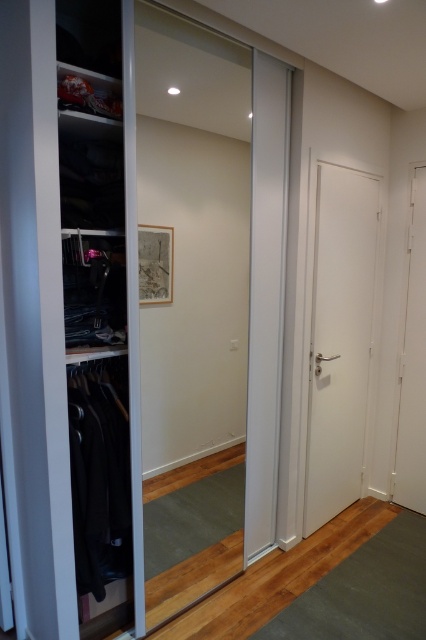
You are standing in front of the walk in closet and want to enter. Which door should you open first, the transparent glass door at center or the white smooth door at right?

You should open the transparent glass door at center first because it is closer to the viewer than the white smooth door at right, so you need to open it first to access the closet.

You are moving a tall plant into the walk in closet and need to pass through the doors. The plant is 2 meters tall. Which door between the white smooth door at right and the white matte door at right should you choose to ensure the plant can fit through without hitting the top?

The white matte door at right is taller than the white smooth door at right. Since the plant is 2 meters tall, you should choose the white matte door at right to ensure it can fit through without hitting the top.